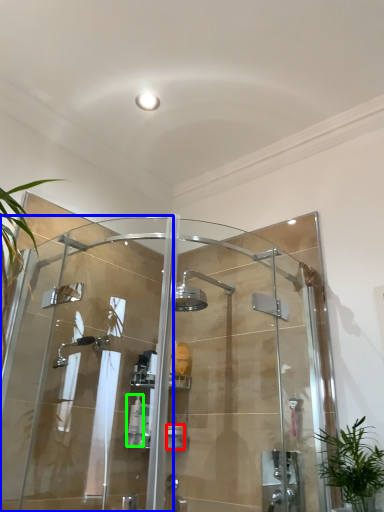
Question: Which object is positioned farthest from toiletry (highlighted by a red box)? Select from screen door (highlighted by a blue box) and toiletry (highlighted by a green box).

Choices:
 (A) screen door
 (B) toiletry

Answer: (A)